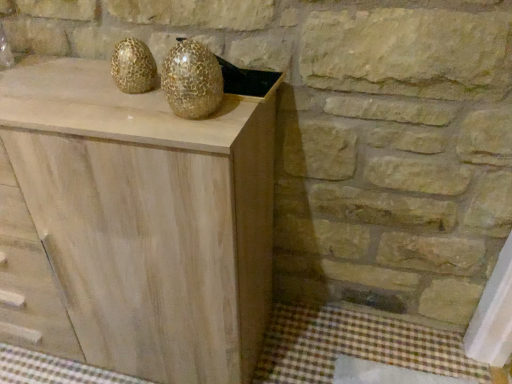
Question: Considering the relative positions of natural wood cabinet at center and gold textured vase at center in the image provided, is natural wood cabinet at center to the left or to the right of gold textured vase at center?

Choices:
 (A) left
 (B) right

Answer: (A)

Question: Considering their positions, is natural wood cabinet at center located in front of or behind gold textured vase at center?

Choices:
 (A) behind
 (B) front

Answer: (B)

Question: Is natural wood cabinet at center bigger or smaller than gold textured vase at center?

Choices:
 (A) small
 (B) big

Answer: (B)

Question: From a real-world perspective, relative to natural wood cabinet at center, is gold textured vase at center vertically above or below?

Choices:
 (A) above
 (B) below

Answer: (A)

Question: Considering the relative positions of gold textured vase at center and natural wood cabinet at center in the image provided, is gold textured vase at center to the left or to the right of natural wood cabinet at center?

Choices:
 (A) right
 (B) left

Answer: (A)

Question: Is point (221, 97) positioned closer to the camera than point (155, 162)?

Choices:
 (A) closer
 (B) farther

Answer: (B)

Question: In terms of size, does gold textured vase at center appear bigger or smaller than natural wood cabinet at center?

Choices:
 (A) big
 (B) small

Answer: (B)